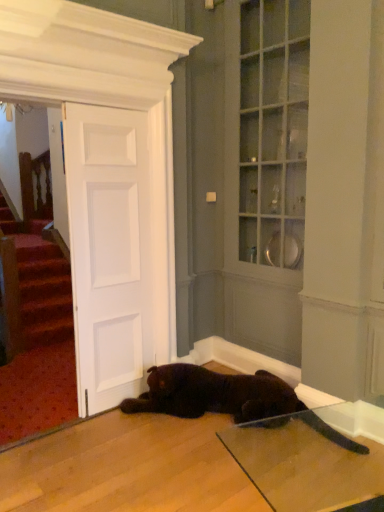
Question: Would you say shiny black cat at lower center is to the left or to the right of white matte door at center in the picture?

Choices:
 (A) left
 (B) right

Answer: (B)

Question: Is shiny black cat at lower center in front of or behind white matte door at center in the image?

Choices:
 (A) front
 (B) behind

Answer: (A)

Question: Is point (183, 408) closer or farther from the camera than point (119, 207)?

Choices:
 (A) closer
 (B) farther

Answer: (B)

Question: From the image's perspective, relative to shiny black cat at lower center, is white matte door at center above or below?

Choices:
 (A) above
 (B) below

Answer: (A)

Question: Considering the positions of white matte door at center and shiny black cat at lower center in the image, is white matte door at center taller or shorter than shiny black cat at lower center?

Choices:
 (A) tall
 (B) short

Answer: (A)

Question: Is white matte door at center spatially inside shiny black cat at lower center, or outside of it?

Choices:
 (A) inside
 (B) outside

Answer: (B)

Question: Considering the positions of white matte door at center and shiny black cat at lower center in the image, is white matte door at center bigger or smaller than shiny black cat at lower center?

Choices:
 (A) small
 (B) big

Answer: (A)